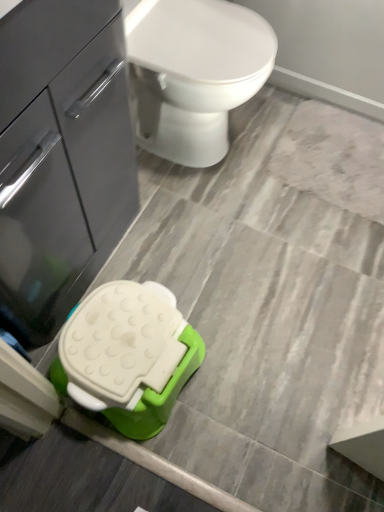
Question: Relative to white glossy toilet at upper center, is matte gray cabinet at left in front or behind?

Choices:
 (A) behind
 (B) front

Answer: (B)

Question: Visually, is matte gray cabinet at left positioned to the left or to the right of white glossy toilet at upper center?

Choices:
 (A) left
 (B) right

Answer: (A)

Question: From the image's perspective, is matte gray cabinet at left located above or below white glossy toilet at upper center?

Choices:
 (A) above
 (B) below

Answer: (B)

Question: Choose the correct answer: Is white glossy toilet at upper center inside matte gray cabinet at left or outside it?

Choices:
 (A) inside
 (B) outside

Answer: (B)

Question: In the image, is white glossy toilet at upper center positioned in front of or behind matte gray cabinet at left?

Choices:
 (A) front
 (B) behind

Answer: (B)

Question: Visually, is white glossy toilet at upper center positioned to the left or to the right of matte gray cabinet at left?

Choices:
 (A) left
 (B) right

Answer: (B)

Question: Is point 155,31 positioned closer to the camera than point 57,8?

Choices:
 (A) farther
 (B) closer

Answer: (A)